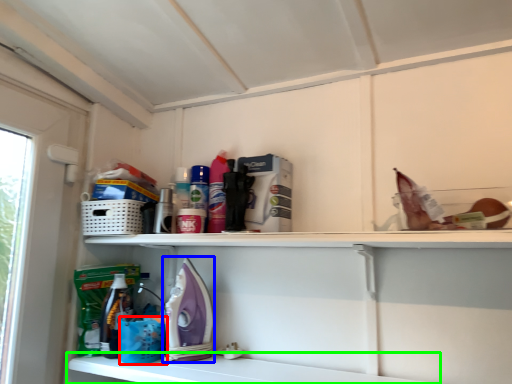
Question: Which is farther away from basket (highlighted by a red box)? appliance (highlighted by a blue box) or shelf (highlighted by a green box)?

Choices:
 (A) appliance
 (B) shelf

Answer: (B)